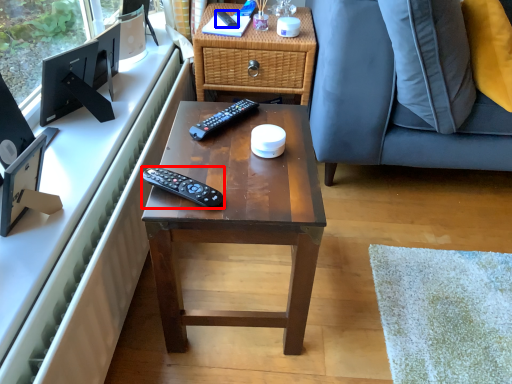
Question: Which point is further to the camera, remote control (highlighted by a red box) or remote control (highlighted by a blue box)?

Choices:
 (A) remote control
 (B) remote control

Answer: (B)